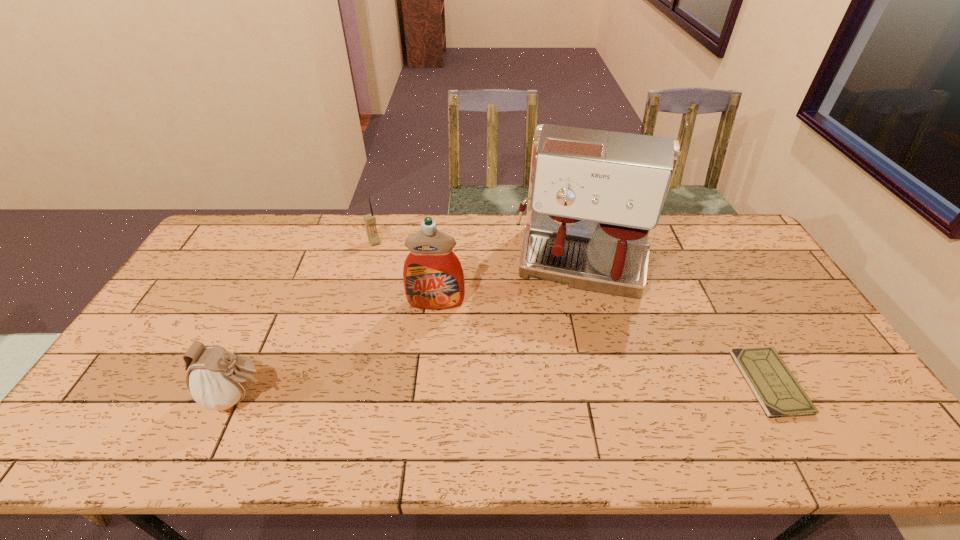
What are the coordinates of `vacant spot on the desktop that is between the pouch and the rightmost object and is positioned on the front of the cellular telephone, where the keypad is located` in the screenshot? It's located at (463, 390).

The width and height of the screenshot is (960, 540). I want to click on free space on the desktop that is between the pouch and the rightmost object and is positioned on the front surface of the fourth shortest object, so click(x=429, y=391).

You are a GUI agent. You are given a task and a screenshot of the screen. Output one action in this format:
    pyautogui.click(x=<x>, y=<y>)
    Task: Click on the vacant space on the desktop that is between the pouch and the rightmost object and is positioned on the front of the coffee maker near the spout
    The width and height of the screenshot is (960, 540).
    Given the screenshot: What is the action you would take?
    pyautogui.click(x=566, y=387)